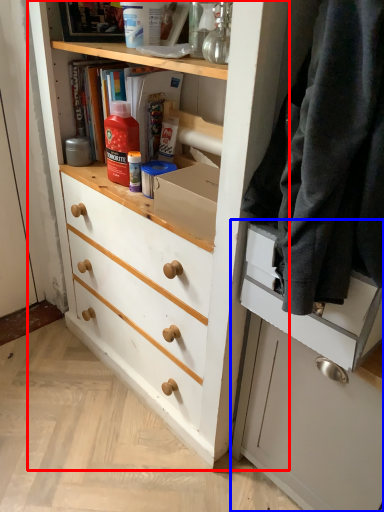
Question: Which object appears closest to the camera in this image, chest of drawers (highlighted by a red box) or cabinetry (highlighted by a blue box)?

Choices:
 (A) chest of drawers
 (B) cabinetry

Answer: (A)